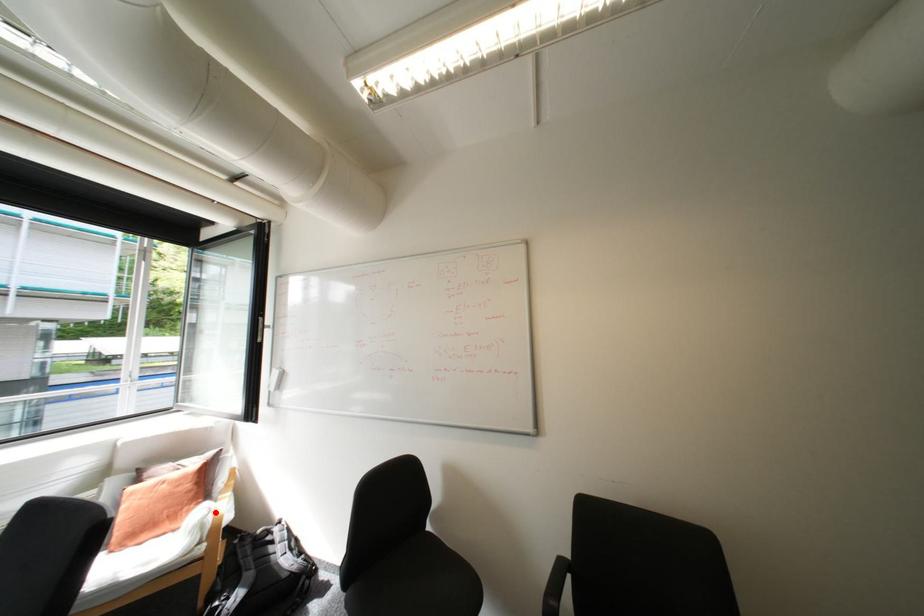
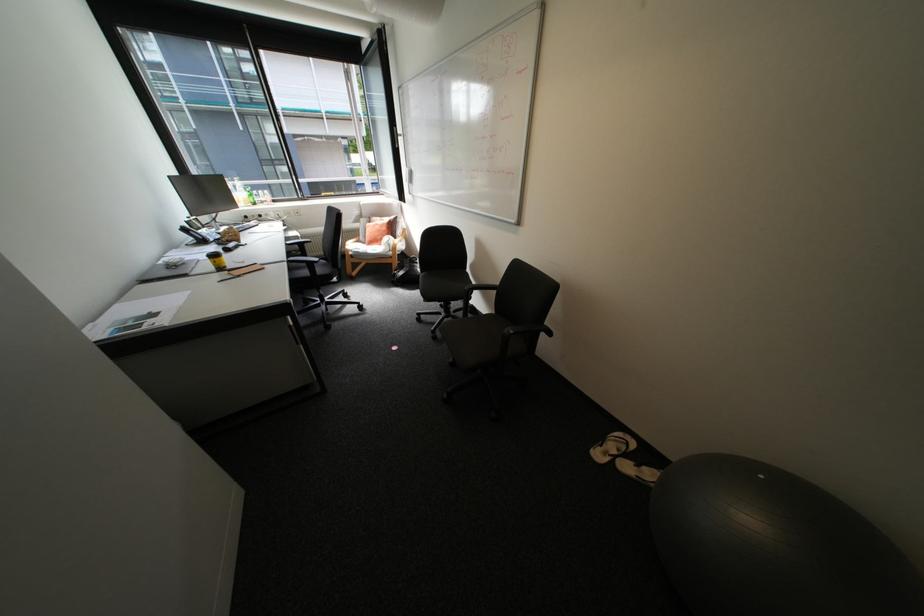
Question: I am providing you with two images of the same scene from different viewpoints. A red point is shown in image1. For the corresponding object point in image2, is it positioned nearer or farther from the camera?

Choices:
 (A) Nearer
 (B) Farther

Answer: (A)